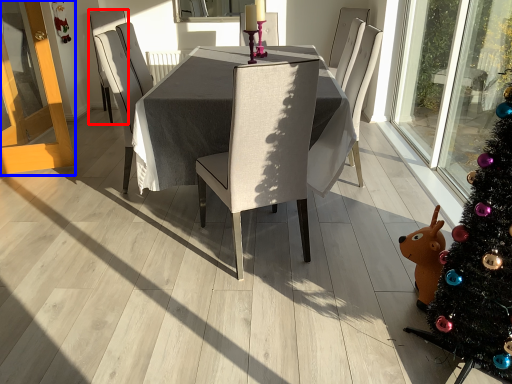
Question: Among these objects, which one is nearest to the camera, chair (highlighted by a red box) or screen door (highlighted by a blue box)?

Choices:
 (A) chair
 (B) screen door

Answer: (B)